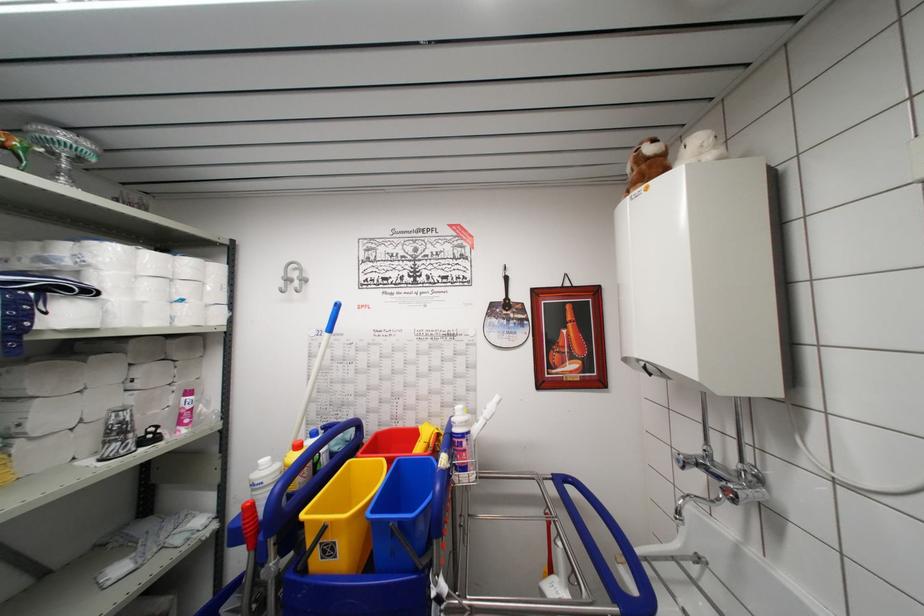
You are a GUI agent. You are given a task and a screenshot of the screen. Output one action in this format:
    pyautogui.click(x=<x>, y=<y>)
    Task: Click on the faucet handle
    The width and height of the screenshot is (924, 616).
    Given the screenshot: What is the action you would take?
    pyautogui.click(x=700, y=501)